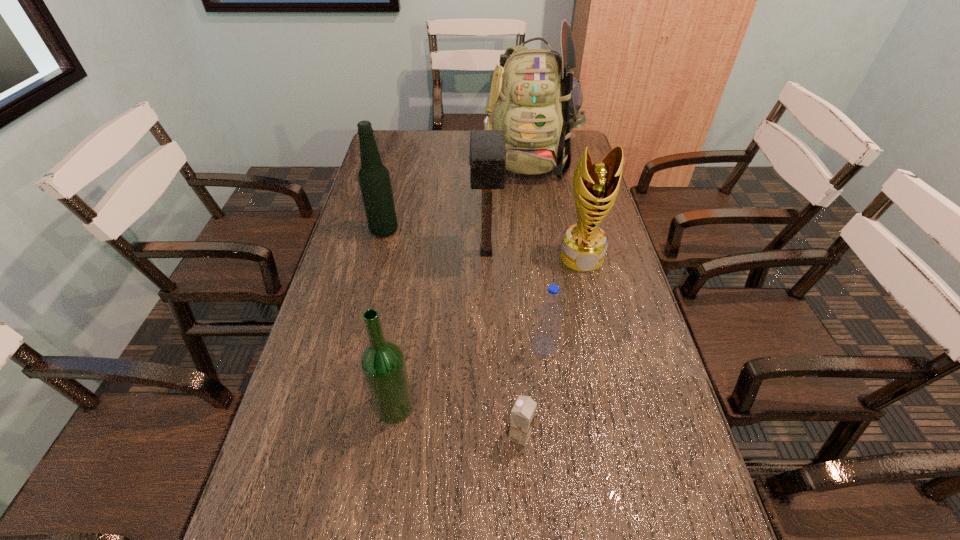
Locate an element on the screen. The image size is (960, 540). the shortest object is located at coordinates (522, 417).

At what (x,y) coordinates should I click in order to perform the action: click on vacant space located on the front-facing side of the backpack. Please return your answer as a coordinate pair (x, y). The width and height of the screenshot is (960, 540). Looking at the image, I should click on (538, 217).

Where is `vacant space located on the right of the mallet`? Image resolution: width=960 pixels, height=540 pixels. vacant space located on the right of the mallet is located at coordinates (621, 253).

Locate an element on the screen. vacant region located 0.310m on the right of the farther alcohol is located at coordinates (496, 231).

Locate an element on the screen. The height and width of the screenshot is (540, 960). free spot located 0.340m on the front-facing side of the award is located at coordinates (610, 374).

Identify the location of vacant space located on the front of the second object from left to right. This screenshot has width=960, height=540. (377, 523).

Where is `free spot located 0.310m on the left of the sixth tallest object`? free spot located 0.310m on the left of the sixth tallest object is located at coordinates (406, 346).

The width and height of the screenshot is (960, 540). I want to click on vacant point located on the back of the shortest object, so click(516, 382).

In order to click on object that is at the far edge in this screenshot , I will do `click(535, 99)`.

I want to click on object present at the left edge, so click(x=374, y=179).